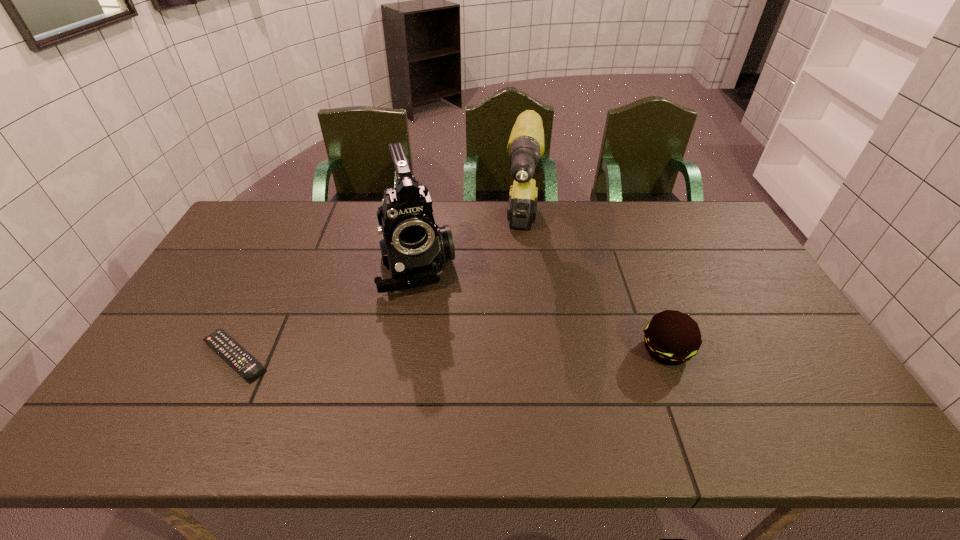
Find the location of a particular element. The height and width of the screenshot is (540, 960). free point between the second object from right to left and the second object from left to right is located at coordinates (469, 251).

You are a GUI agent. You are given a task and a screenshot of the screen. Output one action in this format:
    pyautogui.click(x=<x>, y=<y>)
    Task: Click on the free spot between the third tallest object and the camcorder
    
    Given the screenshot: What is the action you would take?
    click(541, 307)

Locate an element on the screen. vacant area that lies between the drill and the second shortest object is located at coordinates (594, 293).

This screenshot has height=540, width=960. Find the location of `free space between the rightmost object and the leftmost object`. free space between the rightmost object and the leftmost object is located at coordinates (450, 353).

Locate an element on the screen. free space that is in between the second object from right to left and the third tallest object is located at coordinates (594, 293).

This screenshot has height=540, width=960. I want to click on vacant area that lies between the shortest object and the camcorder, so click(325, 310).

Identify which object is located as the third nearest to the patty. Please provide its 2D coordinates. Your answer should be formatted as a tuple, i.e. [(x, y)], where the tuple contains the x and y coordinates of a point satisfying the conditions above.

[(225, 346)]

At what (x,y) coordinates should I click in order to perform the action: click on the third closest object to the camcorder. Please return your answer as a coordinate pair (x, y). Looking at the image, I should click on (671, 337).

The image size is (960, 540). What are the coordinates of `vacant space that satisfies the following two spatial constraints: 1. on the front side of the patty; 2. on the right side of the third object from left to right` in the screenshot? It's located at (535, 349).

Locate an element on the screen. blank area in the image that satisfies the following two spatial constraints: 1. on the back side of the rightmost object; 2. on the left side of the shortest object is located at coordinates (238, 349).